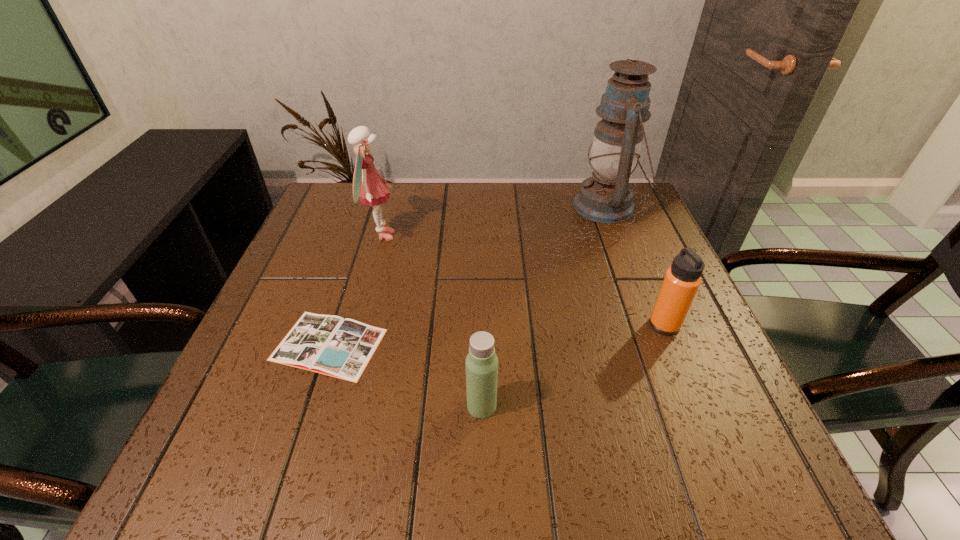
At what (x,y) coordinates should I click in order to perform the action: click on the tallest object. Please return your answer as a coordinate pair (x, y). The width and height of the screenshot is (960, 540). Looking at the image, I should click on (607, 197).

I want to click on doll, so click(x=368, y=184).

The image size is (960, 540). In order to click on the farther thermos bottle in this screenshot , I will do `click(682, 280)`.

Where is `the nearest object`? Image resolution: width=960 pixels, height=540 pixels. the nearest object is located at coordinates (481, 362).

You are a GUI agent. You are given a task and a screenshot of the screen. Output one action in this format:
    pyautogui.click(x=<x>, y=<y>)
    Task: Click on the left thermos bottle
    This screenshot has height=540, width=960.
    Given the screenshot: What is the action you would take?
    pyautogui.click(x=481, y=362)

The height and width of the screenshot is (540, 960). I want to click on the shortest object, so click(327, 344).

Locate an element on the screen. The image size is (960, 540). vacant space located on the left of the oil lamp is located at coordinates [433, 207].

You are a GUI agent. You are given a task and a screenshot of the screen. Output one action in this format:
    pyautogui.click(x=<x>, y=<y>)
    Task: Click on the free spot located 0.320m on the front-facing side of the fourth shortest object
    The height and width of the screenshot is (540, 960).
    Given the screenshot: What is the action you would take?
    pyautogui.click(x=524, y=235)

This screenshot has width=960, height=540. I want to click on free space located on the left of the right thermos bottle, so click(x=492, y=325).

You are a GUI agent. You are given a task and a screenshot of the screen. Output one action in this format:
    pyautogui.click(x=<x>, y=<y>)
    Task: Click on the free space located on the front of the nearest object
    This screenshot has width=960, height=540.
    Given the screenshot: What is the action you would take?
    pyautogui.click(x=482, y=466)